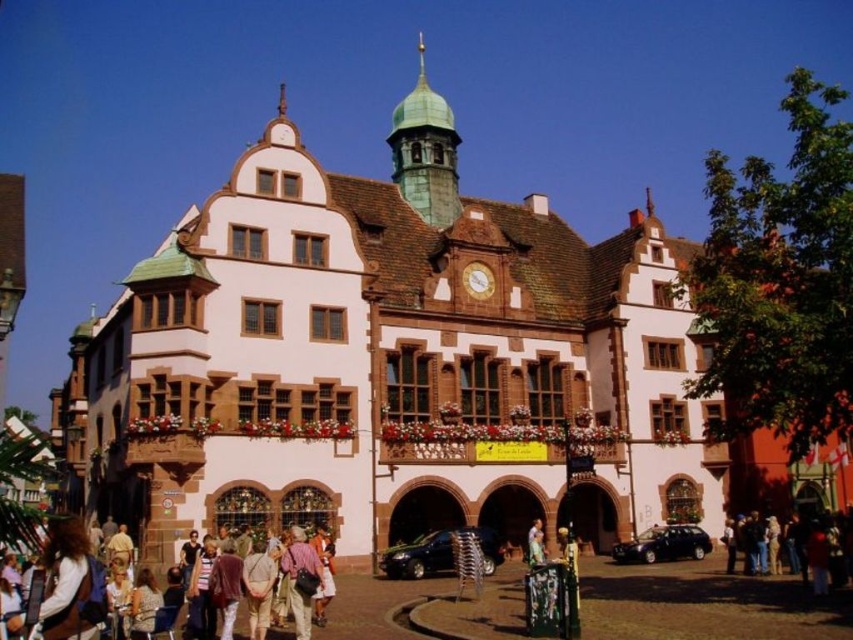
Is green copper bell tower at upper center to the right of light brown leather jacket at center from the viewer's perspective?

Incorrect, green copper bell tower at upper center is not on the right side of light brown leather jacket at center.

Measure the distance between point (426, 189) and camera.

A distance of 73.29 meters exists between point (426, 189) and camera.

Which is behind, point (445, 196) or point (527, 541)?

The point (445, 196) is behind.

This screenshot has height=640, width=853. I want to click on green copper bell tower at upper center, so click(x=425, y=150).

The width and height of the screenshot is (853, 640). What do you see at coordinates (67, 586) in the screenshot? I see `light brown leather jacket at lower left` at bounding box center [67, 586].

Can you confirm if light brown leather jacket at lower left is positioned to the right of light brown leather jacket at center?

In fact, light brown leather jacket at lower left is to the left of light brown leather jacket at center.

Is point (62, 531) positioned before point (532, 563)?

Yes, point (62, 531) is in front of point (532, 563).

The image size is (853, 640). Find the location of `light brown leather jacket at lower left`. light brown leather jacket at lower left is located at coordinates (67, 586).

Identify the location of green copper bell tower at upper center. (425, 150).

Between point (422, 198) and point (74, 596), which one is positioned behind?

The point (422, 198) is behind.

Is point (416, 115) positioned before point (88, 570)?

No, (416, 115) is behind (88, 570).

Image resolution: width=853 pixels, height=640 pixels. In order to click on green copper bell tower at upper center in this screenshot , I will do `click(425, 150)`.